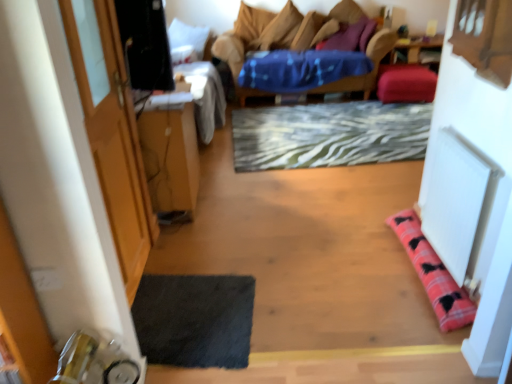
Question: From their relative heights in the image, would you say purple soft pillow at upper center, the first pillow in the top-to-bottom sequence, is taller or shorter than wooden table at left?

Choices:
 (A) tall
 (B) short

Answer: (B)

Question: Would you say purple soft pillow at upper center, placed as the third pillow when sorted from left to right, is to the left or to the right of wooden table at left in the picture?

Choices:
 (A) right
 (B) left

Answer: (A)

Question: Which of these objects is positioned closest to the wooden door at left?

Choices:
 (A) white fabric pillow at upper left, marked as the third pillow in a back-to-front arrangement
 (B) purple soft pillow at upper center, the first pillow in the top-to-bottom sequence
 (C) velvet pink cushion at upper right, the fourth pillow viewed from the left
 (D) wooden table at left
 (E) velvet blue studio couch at center

Answer: (D)

Question: Estimate the real-world distances between objects in this image. Which object is closer to the velvet pink cushion at upper right, the fourth pillow viewed from the left?

Choices:
 (A) purple soft pillow at upper center, placed as the third pillow when sorted from left to right
 (B) pink plaid pillow at lower right, which is counted as the first pillow, starting from the front
 (C) velvet blue studio couch at center
 (D) white fabric pillow at upper left, the 3th pillow in the bottom-to-top sequence
 (E) wooden table at left

Answer: (A)